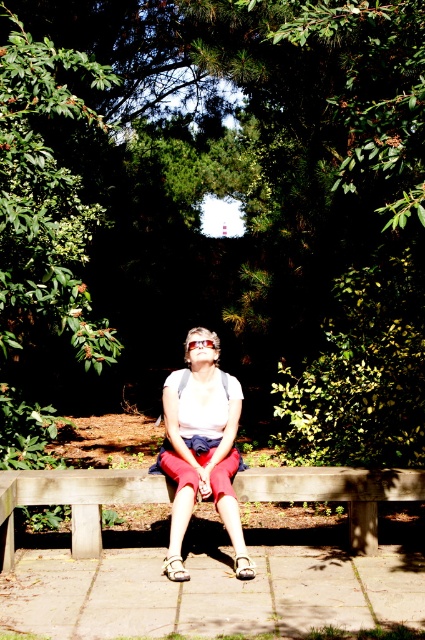
You are standing at the entrance of the park and want to find the wooden bench at center. According to the coordinates provided, in which direction should you walk to reach it?

The wooden bench at center is located at coordinates point (76,500). Since the coordinate system typically has (0,0) at the bottom left corner, moving towards higher x values means moving to the right and higher y values mean moving upwards. Therefore, to reach the wooden bench at center, you should walk to the right and slightly upwards from the entrance.

You are standing in the park and want to walk from point (x=226, y=129) to point (x=200, y=349). Since both points are on the paved area, will you be walking towards or away from the wooden bench?

You will be walking away from the wooden bench because point (x=226, y=129) is closer to the bench than point (x=200, y=349). Since you are moving from a point closer to the bench to one farther away, you are moving away from it.

You are standing at the edge of the park and want to take a photo of the green leafy tree at center. If your camera has a focal length of 50mm and you want to capture the entire tree in the frame, would you need to zoom in or zoom out? Assume the tree is 12 feet tall and your camera sensor has a diagonal of 24mm.

The distance between you and the green leafy tree at center is 14.14 feet. Using the lens formula, the required focal length to capture a 12 feet tall tree at 14.14 feet distance would be approximately 50mm. Since your camera has a 50mm focal length, you don not need to zoom in or out. The current setting should capture the entire tree in the frame.